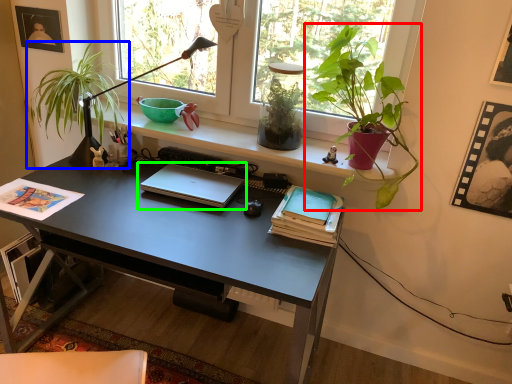
Question: Which object is positioned farthest from houseplant (highlighted by a red box)? Select from houseplant (highlighted by a blue box) and laptop (highlighted by a green box).

Choices:
 (A) houseplant
 (B) laptop

Answer: (A)